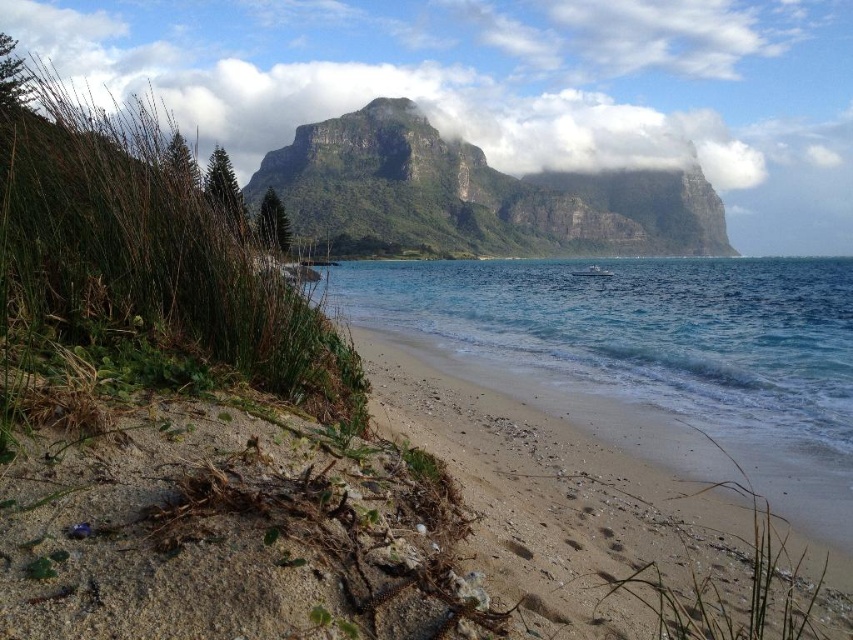
Does clear blue water at center have a larger size compared to rugged stone mountain at center?

Actually, clear blue water at center might be smaller than rugged stone mountain at center.

Who is higher up, clear blue water at center or rugged stone mountain at center?

rugged stone mountain at center is above.

Describe the element at coordinates (640, 333) in the screenshot. This screenshot has width=853, height=640. I see `clear blue water at center` at that location.

The width and height of the screenshot is (853, 640). In order to click on clear blue water at center in this screenshot , I will do `click(640, 333)`.

Can you confirm if clear blue water at center is taller than light brown sandy beach at center?

Indeed, clear blue water at center has a greater height compared to light brown sandy beach at center.

Identify the location of clear blue water at center. This screenshot has width=853, height=640. (640, 333).

Does point (798, 93) come farther from viewer compared to point (834, 570)?

Yes, point (798, 93) is farther from viewer.

Between white fluffy cloud at upper center and light brown sandy beach at center, which one has less height?

light brown sandy beach at center is shorter.

Who is more forward, (346, 17) or (495, 451)?

Point (495, 451) is in front.

Find the location of a particular element. This screenshot has height=640, width=853. white fluffy cloud at upper center is located at coordinates (492, 74).